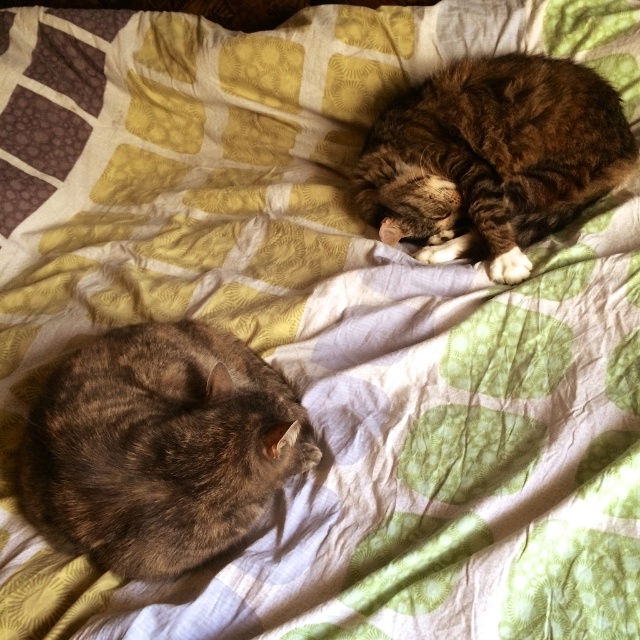
Does gray fur cat at lower left have a greater width compared to tabby fur cat at upper right?

No.

Is gray fur cat at lower left to the left of tabby fur cat at upper right from the viewer's perspective?

Indeed, gray fur cat at lower left is positioned on the left side of tabby fur cat at upper right.

The image size is (640, 640). Describe the element at coordinates (157, 445) in the screenshot. I see `gray fur cat at lower left` at that location.

Where is `gray fur cat at lower left`? This screenshot has height=640, width=640. gray fur cat at lower left is located at coordinates (157, 445).